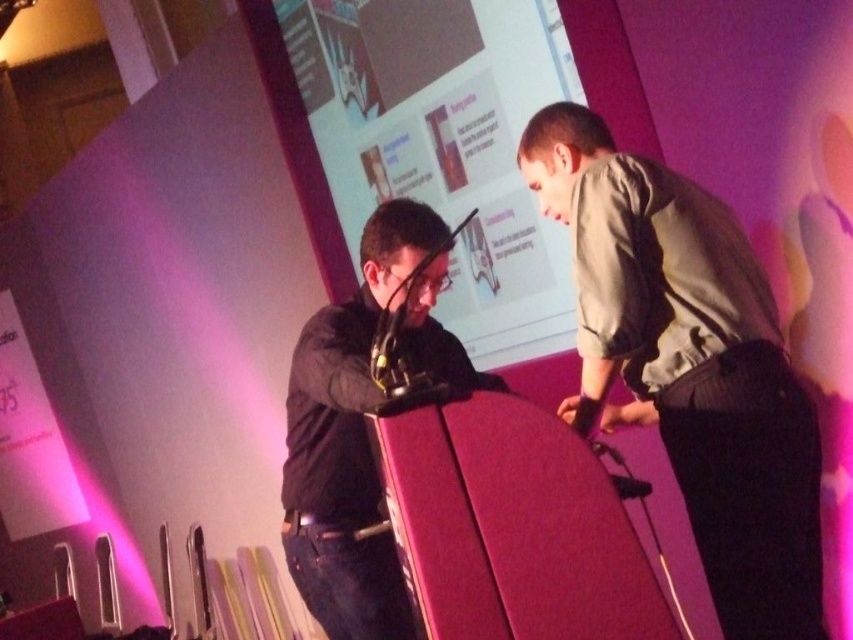
Measure the distance between light gray fabric shirt at right and camera.

They are 5.64 feet apart.

Which is above, light gray fabric shirt at right or black matte jacket at center?

Positioned higher is light gray fabric shirt at right.

Is point (676, 364) behind point (432, 381)?

That is False.

Locate an element on the screen. Image resolution: width=853 pixels, height=640 pixels. light gray fabric shirt at right is located at coordinates (689, 364).